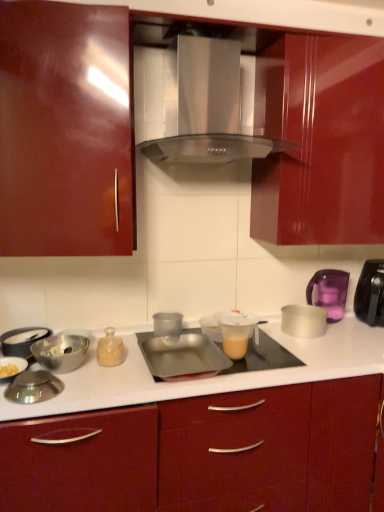
Question: From the image's perspective, is metallic silver pan at left, arranged as the 8th appliance when viewed from the right, under satin silver range hood at center?

Choices:
 (A) yes
 (B) no

Answer: (A)

Question: Is metallic silver pan at left, arranged as the first appliance when viewed from the left, positioned with its back to satin silver range hood at center?

Choices:
 (A) no
 (B) yes

Answer: (A)

Question: Is metallic silver pan at left, arranged as the 8th appliance when viewed from the right, next to satin silver range hood at center and touching it?

Choices:
 (A) no
 (B) yes

Answer: (A)

Question: Is metallic silver pan at left, arranged as the 8th appliance when viewed from the right, taller than satin silver range hood at center?

Choices:
 (A) yes
 (B) no

Answer: (B)

Question: Does metallic silver pan at left, arranged as the 8th appliance when viewed from the right, appear on the left side of satin silver range hood at center?

Choices:
 (A) yes
 (B) no

Answer: (A)

Question: In the image, is metallic silver tray at center, the 4th appliance from the right, on the left side or the right side of glossy wood cabinet at upper center, positioned as the 2th cabinetry in bottom-to-top order?

Choices:
 (A) right
 (B) left

Answer: (B)

Question: From the image's perspective, is metallic silver tray at center, the 4th appliance from the right, located above or below glossy wood cabinet at upper center, positioned as the 1th cabinetry in top-to-bottom order?

Choices:
 (A) below
 (B) above

Answer: (A)

Question: Considering the positions of metallic silver tray at center, the 4th appliance from the right, and glossy wood cabinet at upper center, positioned as the 1th cabinetry in top-to-bottom order, in the image, is metallic silver tray at center, the 4th appliance from the right, bigger or smaller than glossy wood cabinet at upper center, positioned as the 1th cabinetry in top-to-bottom order,?

Choices:
 (A) small
 (B) big

Answer: (A)

Question: From their relative heights in the image, would you say metallic silver tray at center, the 4th appliance from the right, is taller or shorter than glossy wood cabinet at upper center, positioned as the 1th cabinetry in top-to-bottom order?

Choices:
 (A) tall
 (B) short

Answer: (B)

Question: Is point (9, 374) closer or farther from the camera than point (9, 342)?

Choices:
 (A) closer
 (B) farther

Answer: (A)

Question: Considering the positions of metallic silver bowl at lower left, which appears as the 2th appliance when viewed from the left, and metallic silver pan at left, arranged as the first appliance when viewed from the left, in the image, is metallic silver bowl at lower left, which appears as the 2th appliance when viewed from the left, taller or shorter than metallic silver pan at left, arranged as the first appliance when viewed from the left,?

Choices:
 (A) short
 (B) tall

Answer: (A)

Question: Looking at their shapes, would you say metallic silver bowl at lower left, which appears as the 2th appliance when viewed from the left, is wider or thinner than metallic silver pan at left, arranged as the 8th appliance when viewed from the right?

Choices:
 (A) wide
 (B) thin

Answer: (B)

Question: Is metallic silver bowl at lower left, which is the 7th appliance from right to left, spatially inside metallic silver pan at left, arranged as the first appliance when viewed from the left, or outside of it?

Choices:
 (A) outside
 (B) inside

Answer: (A)

Question: Is shiny silver lid at lower left, the third appliance in the left-to-right sequence, in front of or behind transparent plastic cup at center, the 5th appliance when ordered from right to left, in the image?

Choices:
 (A) front
 (B) behind

Answer: (A)

Question: In terms of width, does shiny silver lid at lower left, the third appliance in the left-to-right sequence, look wider or thinner when compared to transparent plastic cup at center, the 5th appliance when ordered from right to left?

Choices:
 (A) wide
 (B) thin

Answer: (A)